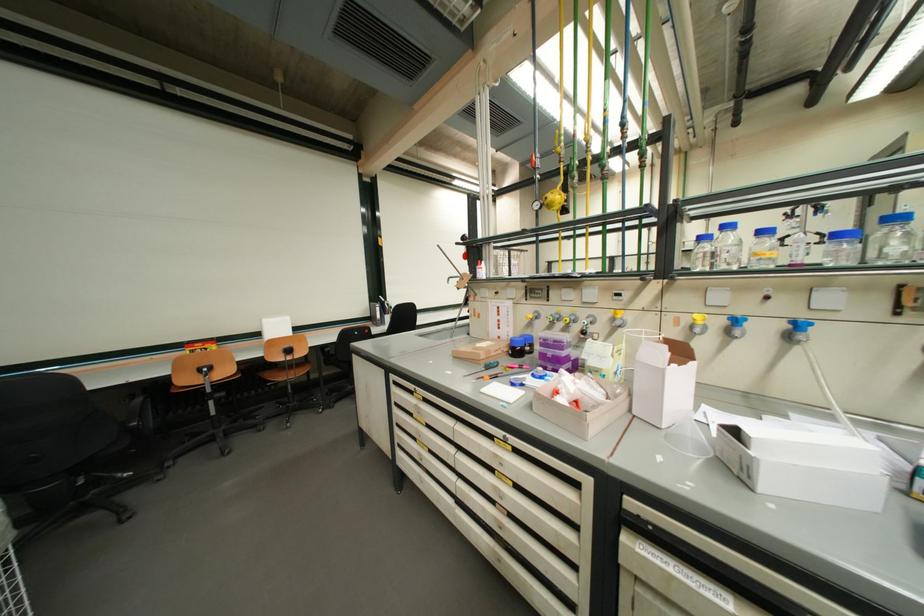
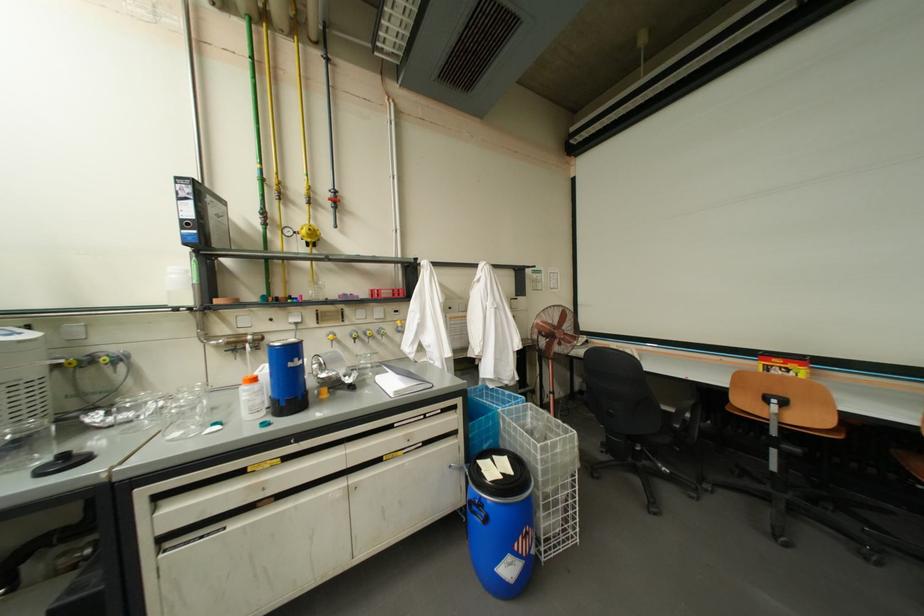
Question: The camera is either moving clockwise (left) or counter-clockwise (right) around the object. The first image is from the beginning of the video and the second image is from the end. Is the camera moving left or right when shooting the video?

Choices:
 (A) Left
 (B) Right

Answer: (B)